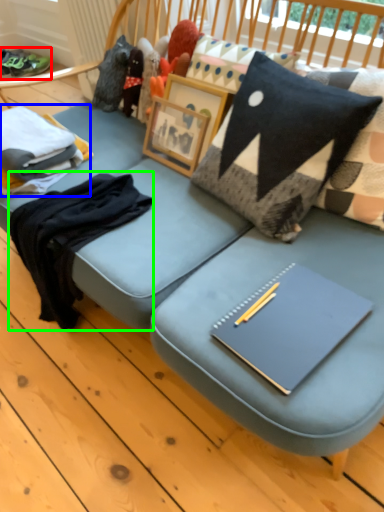
Question: Estimate the real-world distances between objects in this image. Which object is farther from footwear (highlighted by a red box), clothing (highlighted by a blue box) or clothing (highlighted by a green box)?

Choices:
 (A) clothing
 (B) clothing

Answer: (B)